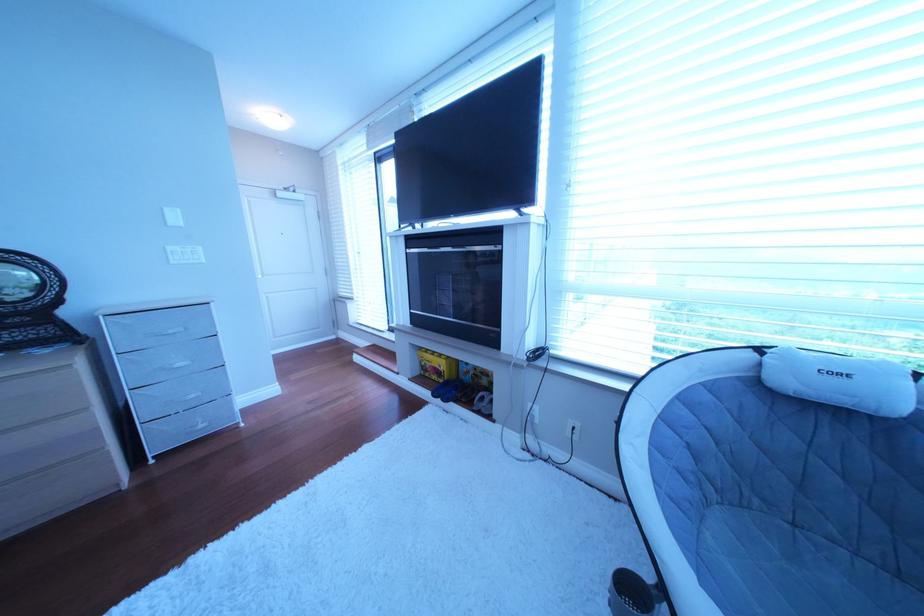
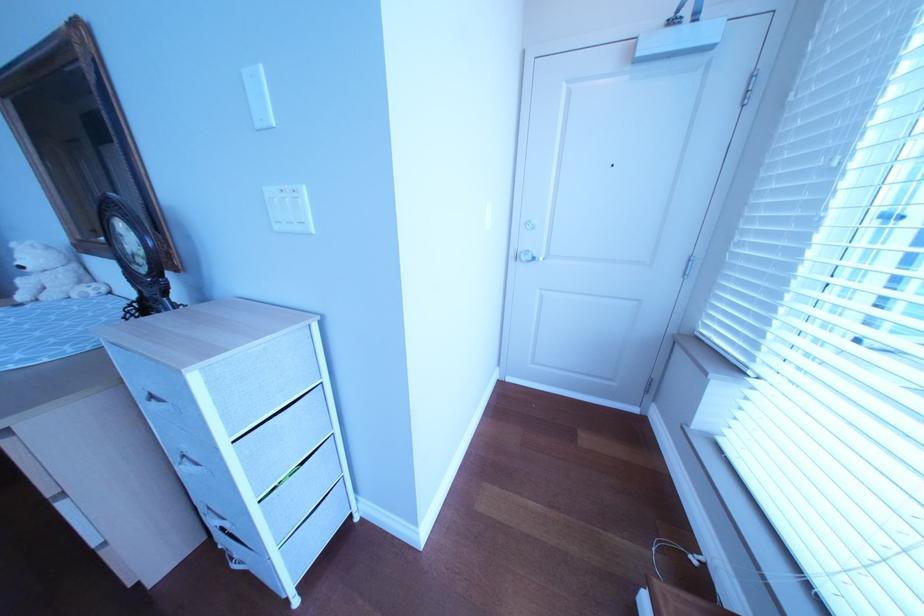
In the second image, find the point that corresponds to [188,264] in the first image.

(292, 229)